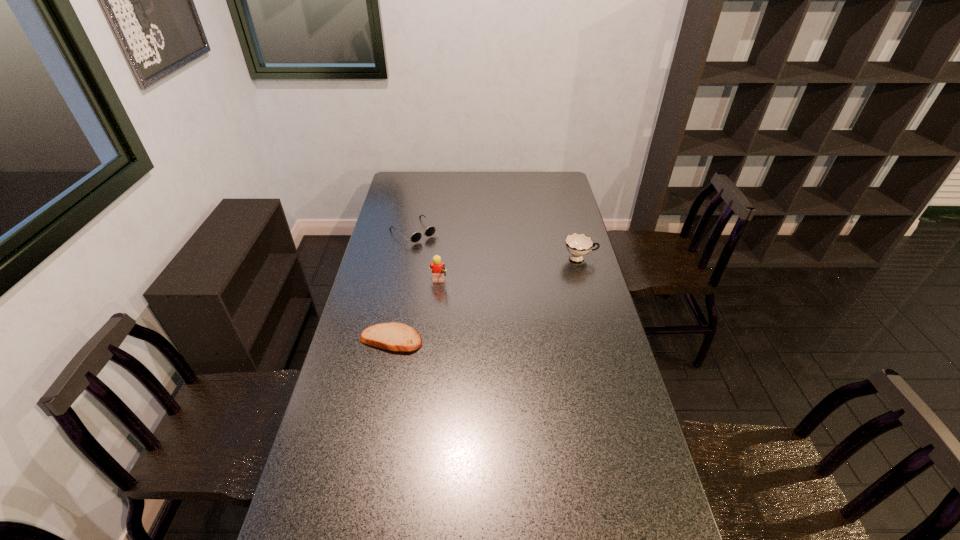
The height and width of the screenshot is (540, 960). Find the location of `free space on the desktop that is between the pita bread and the third nearest object and is positioned in front of the tallest object with the accessory visible`. free space on the desktop that is between the pita bread and the third nearest object and is positioned in front of the tallest object with the accessory visible is located at coordinates (519, 285).

Image resolution: width=960 pixels, height=540 pixels. I want to click on vacant space on the desktop that is between the nearest object and the third nearest object and is positioned on the front-facing side of the farthest object, so click(489, 298).